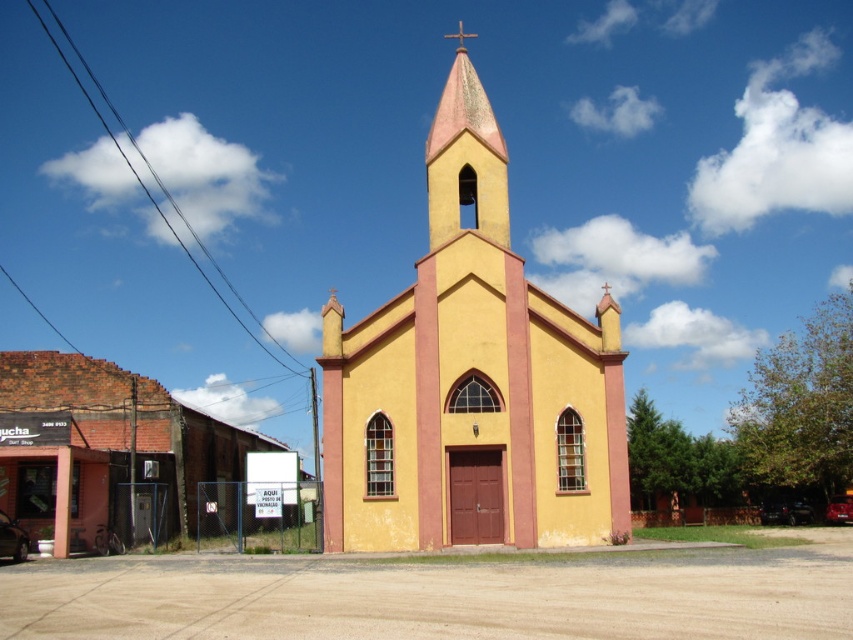
You are standing in front of the church and want to walk towards the point that is closer to the entrance. Which point should you head towards, point (403, 541) or point (437, 109)?

Point (403, 541) is in front of point (437, 109), so you should head towards point (403, 541) as it is closer to the entrance.

You are standing in front of the yellow matte church at center and want to reach the pink matte steeple at center. Given that the path between them is clear, can you walk directly to the steeple without any obstacles?

The distance between the yellow matte church at center and the pink matte steeple at center is 4.24 meters. Since the path is clear, you can walk directly to the steeple without any obstacles.

You are planning to place a new garden decoration between the yellow matte church at center and the pink matte steeple at center. Based on their widths, which one should you place closer to the center to ensure the decoration fits properly?

The yellow matte church at center is wider than the pink matte steeple at center, so placing the decoration closer to the steeple would allow it to fit between them.